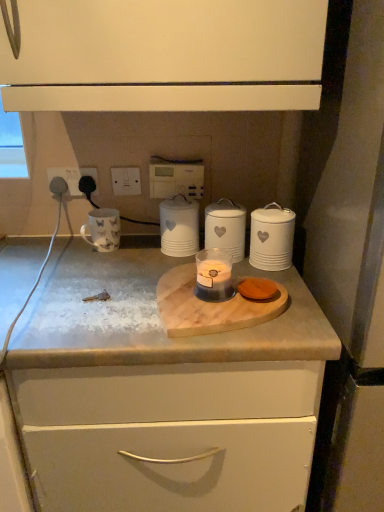
Where is `free space in front of white matte canister at right, the first home appliance when ordered from right to left`? The image size is (384, 512). free space in front of white matte canister at right, the first home appliance when ordered from right to left is located at coordinates (292, 292).